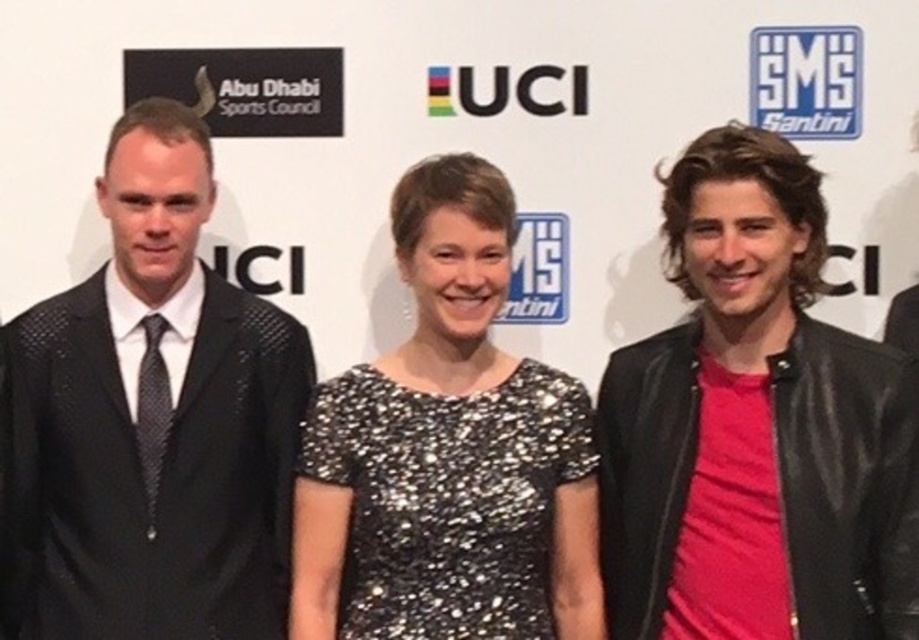
Question: Which is farther from the black textured suit at left?

Choices:
 (A) red leather jacket at right
 (B) sparkly black dress at center

Answer: (A)

Question: Which of these objects is positioned farthest from the red leather jacket at right?

Choices:
 (A) black textured suit at left
 (B) sparkly black dress at center

Answer: (A)

Question: Does red leather jacket at right have a greater width compared to sparkly black dress at center?

Choices:
 (A) yes
 (B) no

Answer: (B)

Question: Which is farther from the black textured suit at left?

Choices:
 (A) red leather jacket at right
 (B) sparkly black dress at center

Answer: (A)

Question: Can you confirm if black textured suit at left is smaller than sparkly black dress at center?

Choices:
 (A) yes
 (B) no

Answer: (B)

Question: Does red leather jacket at right lie behind black textured suit at left?

Choices:
 (A) no
 (B) yes

Answer: (A)